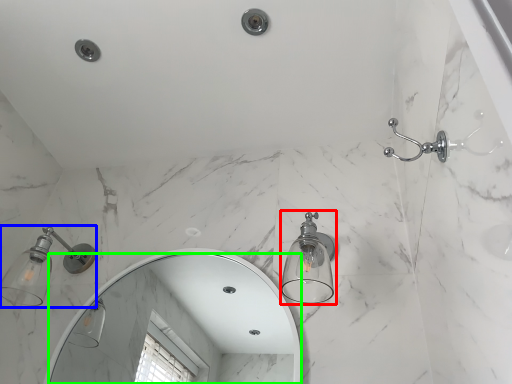
Question: Based on their relative distances, which object is farther from light fixture (highlighted by a red box)? Choose from light fixture (highlighted by a blue box) and mirror (highlighted by a green box).

Choices:
 (A) light fixture
 (B) mirror

Answer: (B)